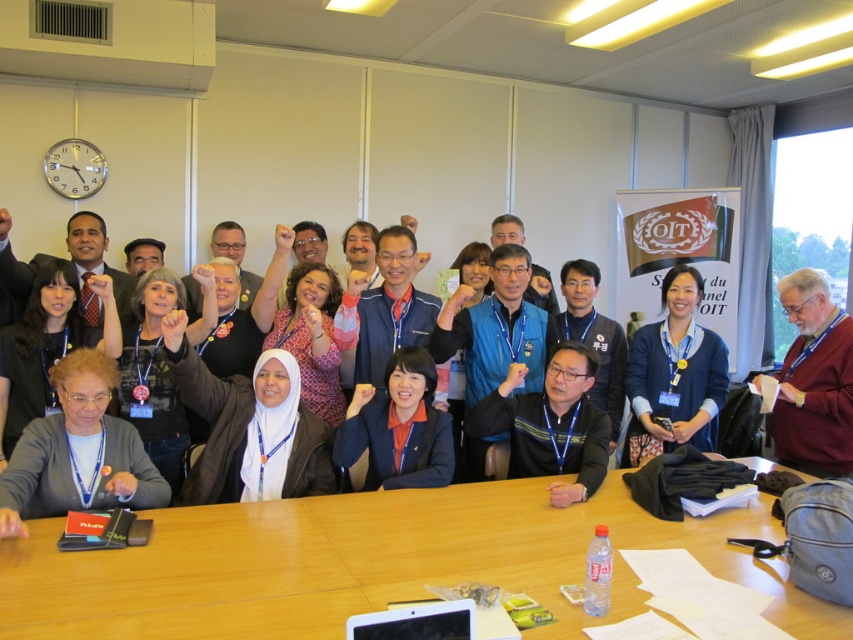
You need to place the blue fabric jacket at center on top of the wooden table at center. Considering their sizes, will the jacket fit entirely on the table without hanging off the edges?

The wooden table at center is bigger than the blue fabric jacket at center, so the jacket will fit entirely on the table without any part hanging off the edges.

You are organizing a coat check area for an event and need to determine which item to place on a larger hanger. You see the blue sweater at center and the blue fabric jacket at center in the image. Which item requires the larger hanger based on their sizes?

The blue sweater at center requires the larger hanger because it is larger in size than the blue fabric jacket at center.

You are organizing a photo shoot and need to place a small accessory between the blue sweater at center and the blue fabric jacket at center. Based on their positions, on which side of the jacket should you place the accessory to ensure it is between them?

The blue sweater at center is positioned on the right side of the blue fabric jacket at center, so you should place the accessory to the right of the blue fabric jacket at center to position it between them.